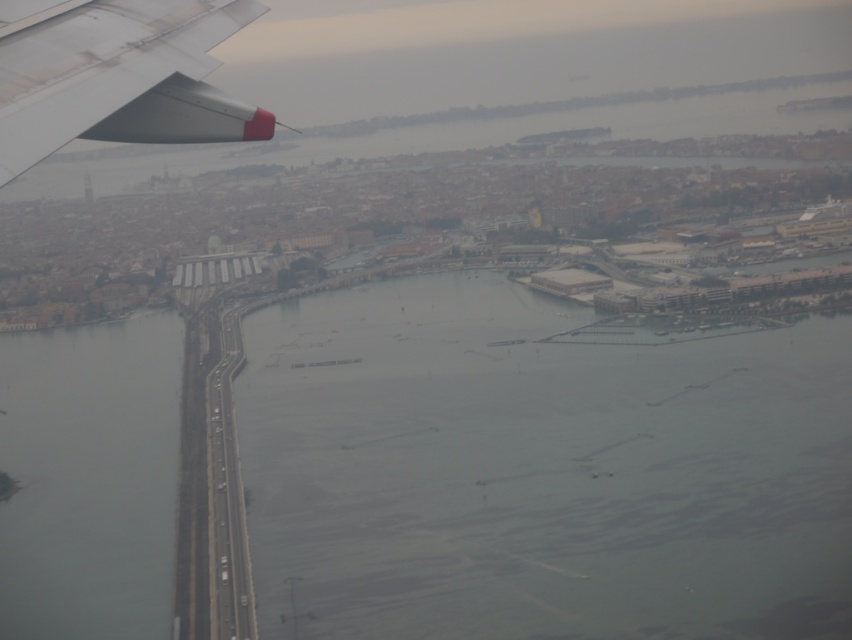
You are a pilot preparing to land the plane. You notice the gray water at center and the matte white wing at upper left in your view. Which object is closer to the left side of your view?

The matte white wing at upper left is closer to the left side of your view because it is positioned to the left of the gray water at center.

You are a pilot trying to navigate an airplane to land at the airport. The runway is located at the gray water at center. According to the coordinates provided, what are the exact coordinates of the runway?

The gray water at center is located at coordinates point (539, 468).